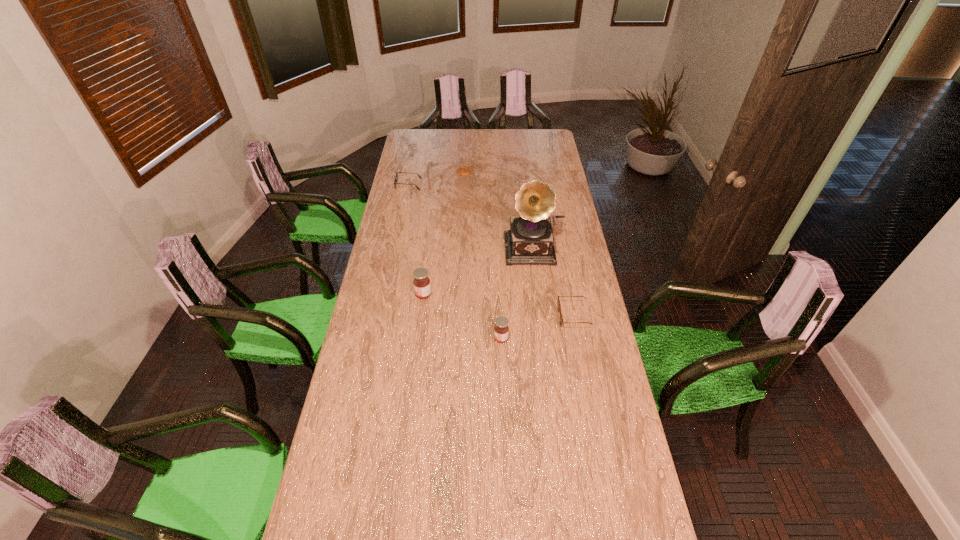
Identify the location of the taller jam. This screenshot has height=540, width=960. (421, 282).

This screenshot has height=540, width=960. In order to click on the farther jam in this screenshot , I will do 421,282.

Locate an element on the screen. The height and width of the screenshot is (540, 960). the third object from right to left is located at coordinates (501, 329).

Where is `the shorter jam`? This screenshot has height=540, width=960. the shorter jam is located at coordinates [x=501, y=329].

Image resolution: width=960 pixels, height=540 pixels. Identify the location of the fourth object from right to left. (463, 170).

Identify the location of the farthest object. The width and height of the screenshot is (960, 540). (463, 170).

Where is `the left spectacles`? the left spectacles is located at coordinates (397, 172).

This screenshot has width=960, height=540. What are the coordinates of `the leftmost object` in the screenshot? It's located at pyautogui.click(x=397, y=172).

The height and width of the screenshot is (540, 960). I want to click on the third farthest object, so click(530, 239).

The width and height of the screenshot is (960, 540). I want to click on the tallest object, so click(530, 239).